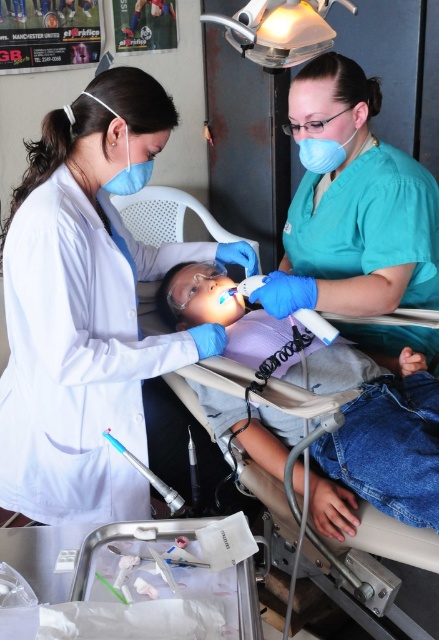
You are a dental assistant in the clinic. You need to place a new tool on the table between the two points labeled point (x=90, y=388) and point (x=338, y=468). Since you want the tool to be as close as possible to the dental professional on the right, where should you place it?

Place the tool closer to point (x=338, y=468) because it is in front of point (x=90, y=388), making it nearer to the dental professional on the right.

Consider the image. You are a dental assistant who needs to ensure all equipment fits on a 2 meter wide tray. Given the blue smooth dental chair at center and the blue fabric mask at upper center, which one will definitely fit on the tray?

The blue smooth dental chair at center has a larger width than the blue fabric mask at upper center, so the blue fabric mask at upper center will definitely fit on the 2 meter wide tray.